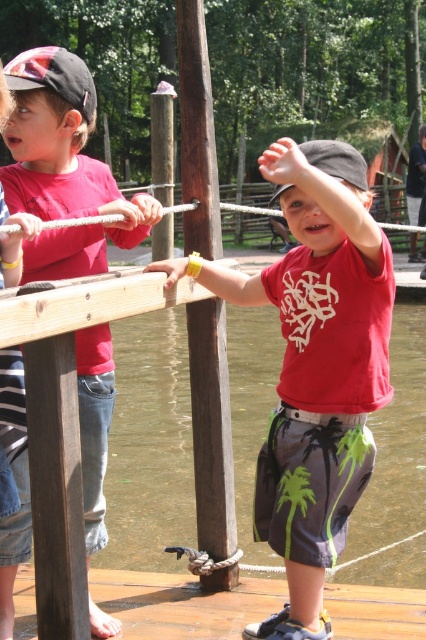
You are a maintenance worker inspecting the wooden dock at lower center and the brown wood pole at center. According to safety regulations, the pole must be positioned above the dock to ensure stability. Is the current arrangement compliant with the safety standards?

The brown wood pole at center is above the wooden dock at lower center, so the arrangement is compliant with safety standards as it meets the requirement of the pole being positioned above the dock for stability.